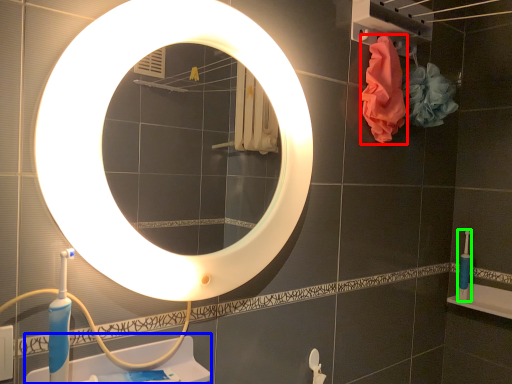
Question: Which object is positioned farthest from material (highlighted by a red box)? Select from sink (highlighted by a blue box) and toothbrush (highlighted by a green box).

Choices:
 (A) sink
 (B) toothbrush

Answer: (A)